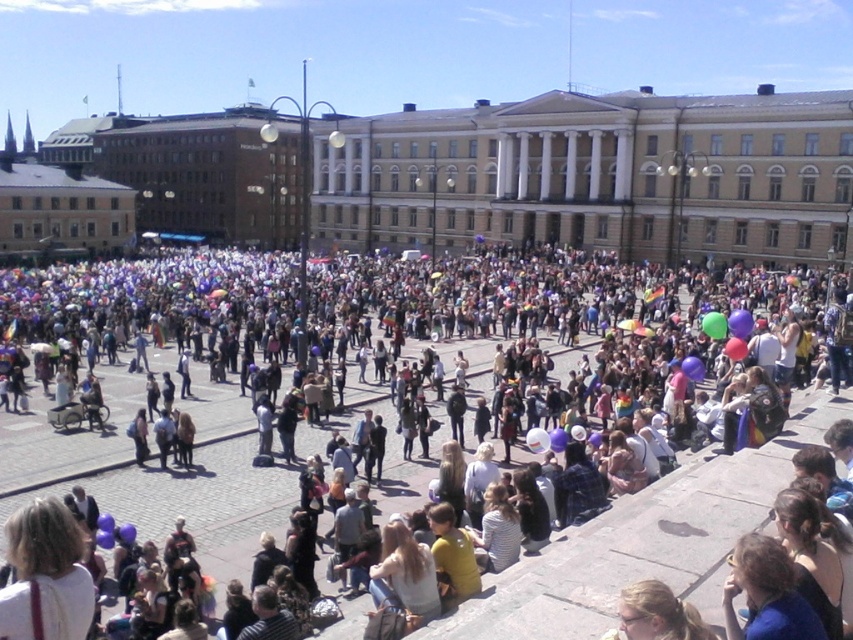
Between point (654, 115) and point (747, 314), which one is positioned behind?

The point (654, 115) is behind.

Which of these two, yellow stone building at center or translucent purple balloon at center, stands shorter?

Standing shorter between the two is translucent purple balloon at center.

Is point (312, 122) farther from camera compared to point (740, 314)?

Yes.

You are a GUI agent. You are given a task and a screenshot of the screen. Output one action in this format:
    pyautogui.click(x=<x>, y=<y>)
    Task: Click on the yellow stone building at center
    
    Given the screenshot: What is the action you would take?
    pyautogui.click(x=595, y=176)

Between dark blue shirt at lower right and light brown hair at lower center, which one appears on the right side from the viewer's perspective?

Positioned to the right is dark blue shirt at lower right.

Identify the location of dark blue shirt at lower right. This screenshot has height=640, width=853. (767, 593).

Does yellow stone building at center appear on the left side of rubber balloon at lower right?

Yes, yellow stone building at center is to the left of rubber balloon at lower right.

Is yellow stone building at center behind rubber balloon at lower right?

Yes, it is behind rubber balloon at lower right.

Between point (824, 177) and point (706, 317), which one is positioned behind?

The point (824, 177) is behind.

Locate an element on the screen. The height and width of the screenshot is (640, 853). yellow stone building at center is located at coordinates (595, 176).